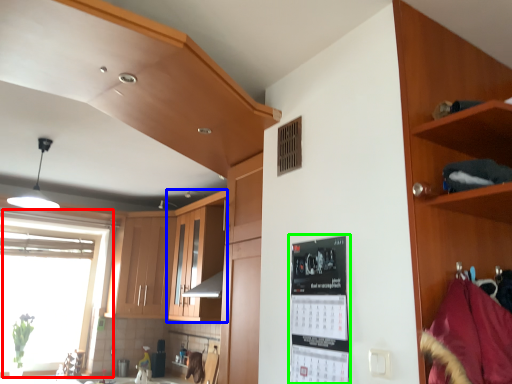
Question: Considering the real-world distances, which object is farthest from window (highlighted by a red box)? cabinetry (highlighted by a blue box) or bulletin board (highlighted by a green box)?

Choices:
 (A) cabinetry
 (B) bulletin board

Answer: (B)